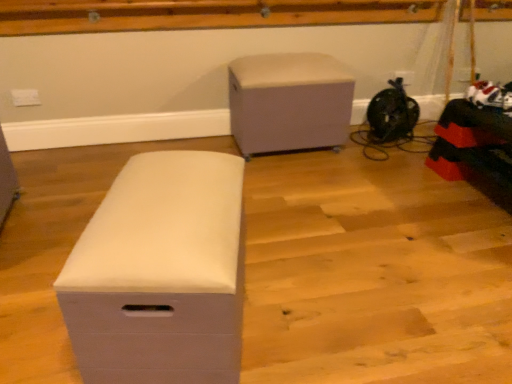
Question: In terms of height, does beige fabric ottoman at center, acting as the 1th furniture starting from the top, look taller or shorter compared to matte white storage box at center, marked as the 2th furniture in a back-to-front arrangement?

Choices:
 (A) tall
 (B) short

Answer: (A)

Question: Is point (327, 81) closer or farther from the camera than point (155, 375)?

Choices:
 (A) closer
 (B) farther

Answer: (B)

Question: In the image, is beige fabric ottoman at center, positioned as the second furniture in left-to-right order, positioned in front of or behind matte white storage box at center, arranged as the first furniture when viewed from the left?

Choices:
 (A) front
 (B) behind

Answer: (B)

Question: In terms of height, does matte white storage box at center, the second furniture from the right, look taller or shorter compared to beige fabric ottoman at center, which is the second furniture from front to back?

Choices:
 (A) short
 (B) tall

Answer: (A)

Question: Would you say matte white storage box at center, acting as the first furniture starting from the bottom, is to the left or to the right of beige fabric ottoman at center, positioned as the second furniture in left-to-right order, in the picture?

Choices:
 (A) left
 (B) right

Answer: (A)

Question: Is point (93, 342) closer or farther from the camera than point (280, 150)?

Choices:
 (A) farther
 (B) closer

Answer: (B)

Question: Is matte white storage box at center, acting as the first furniture starting from the bottom, wider or thinner than beige fabric ottoman at center, which appears as the first furniture when viewed from the back?

Choices:
 (A) thin
 (B) wide

Answer: (A)